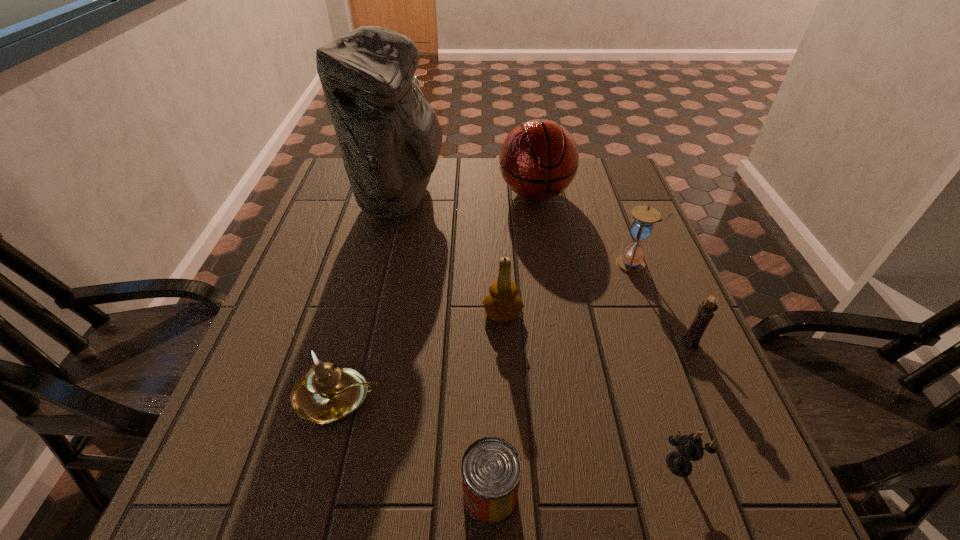
At what (x,y) coordinates should I click in order to perform the action: click on the tallest object. Please return your answer as a coordinate pair (x, y). The image size is (960, 540). Looking at the image, I should click on (389, 135).

Where is `the second tallest object`? the second tallest object is located at coordinates (539, 159).

Identify the location of hourglass. The height and width of the screenshot is (540, 960). (631, 262).

Where is `the farthest candle holder`? the farthest candle holder is located at coordinates (503, 304).

Locate an element on the screen. the third candle holder from right to left is located at coordinates (503, 304).

Locate an element on the screen. The width and height of the screenshot is (960, 540). the leftmost candle holder is located at coordinates (327, 393).

Locate an element on the screen. The width and height of the screenshot is (960, 540). the sixth farthest object is located at coordinates (327, 393).

Where is `the rightmost object`? the rightmost object is located at coordinates (706, 309).

Find the location of a particular element. The width and height of the screenshot is (960, 540). the third nearest candle holder is located at coordinates pos(706,309).

Where is `the second candle holder from right to left`? This screenshot has height=540, width=960. the second candle holder from right to left is located at coordinates (689, 448).